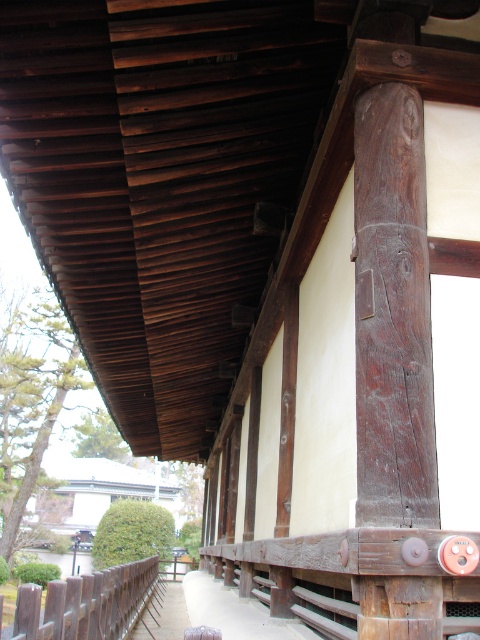
Where is `dark brown wood at center`? The image size is (480, 640). dark brown wood at center is located at coordinates (393, 314).

Does point (387, 209) lie in front of point (74, 637)?

Yes, it is.

Who is more distant from viewer, (x=392, y=634) or (x=38, y=637)?

The point (x=38, y=637) is more distant.

Locate an element on the screen. dark brown wood at center is located at coordinates (393, 314).